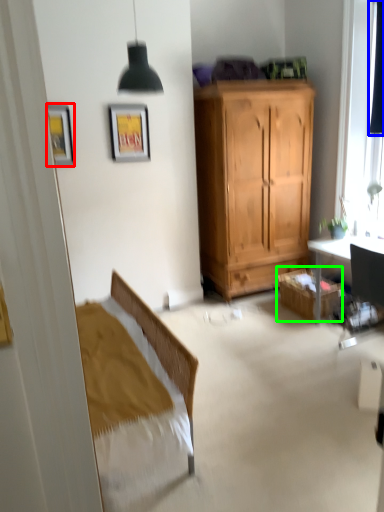
Question: Considering the real-world distances, which object is closest to picture frame (highlighted by a red box)? curtain (highlighted by a blue box) or cabinetry (highlighted by a green box).

Choices:
 (A) curtain
 (B) cabinetry

Answer: (B)